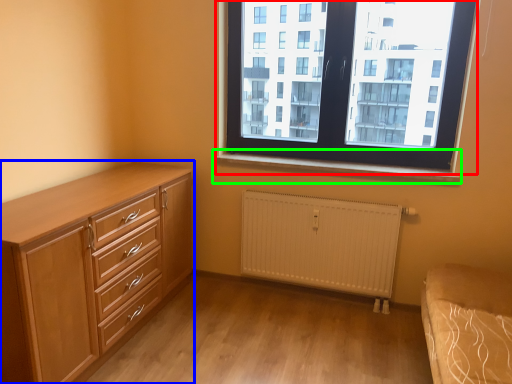
Question: Which object is the closest to the window (highlighted by a red box)? Choose among these: chest of drawers (highlighted by a blue box) or window sill (highlighted by a green box).

Choices:
 (A) chest of drawers
 (B) window sill

Answer: (B)